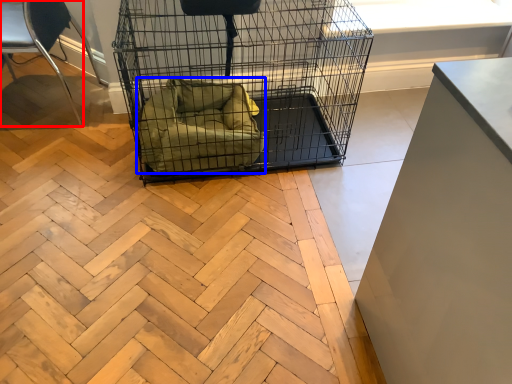
Question: Which of the following is the farthest to the observer, chair (highlighted by a red box) or dog bed (highlighted by a blue box)?

Choices:
 (A) chair
 (B) dog bed

Answer: (B)